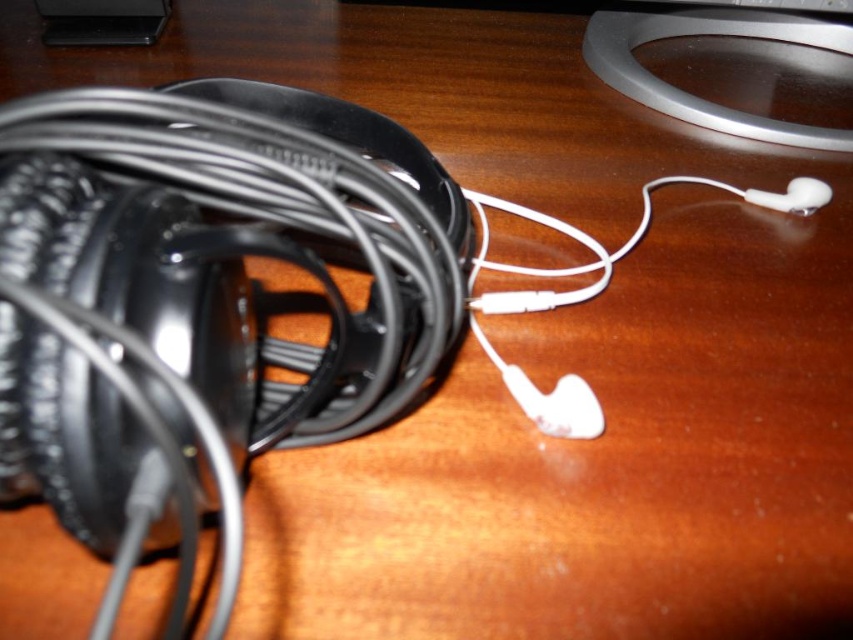
What object is located at the coordinate point [236,243] in the image?

The point [236,243] marks the location of the black matte wire at left.

You are trying to locate the black matte wire at left in the image. According to the coordinates provided, where exactly is it positioned?

The black matte wire at left is positioned at coordinates point (236, 243).

You are a delivery robot that needs to move from the starting point to the destination point. The starting point is at point (239, 371) and the destination is at point (755, 196). Given that there are two sets of earphones on the wooden surface, which one is closer to your starting point?

Point (239, 371) is in front of point (755, 196), so the starting point is closer to the coiled black wired over ear headphone on the left side.